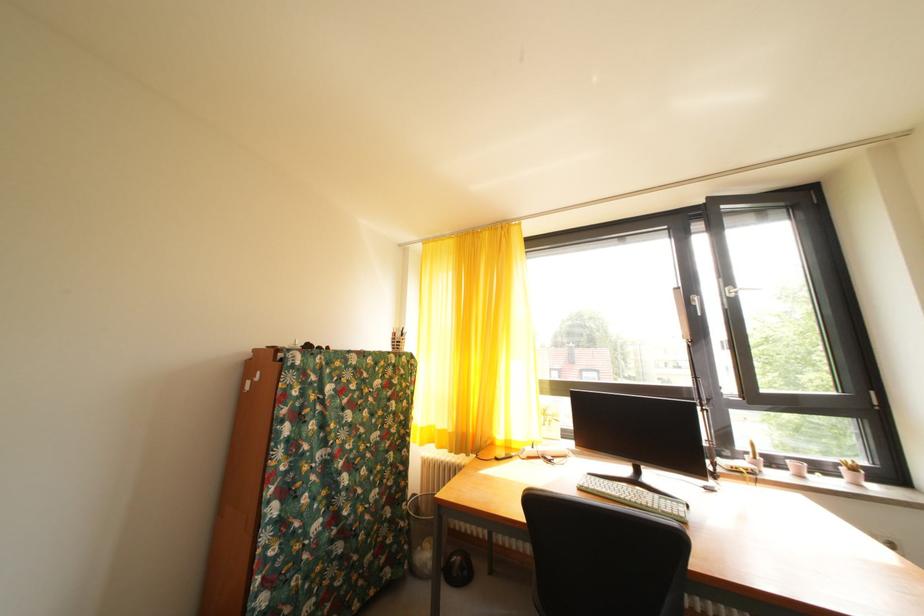
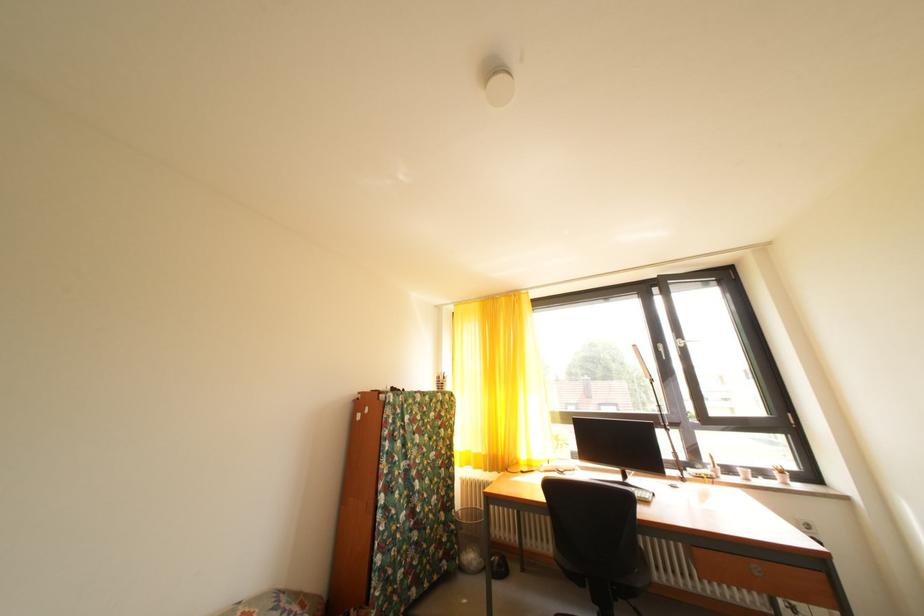
Question: Based on the continuous images, in which direction is the camera rotating? Reply with the corresponding letter.

Choices:
 (A) Left
 (B) Right
 (C) Up
 (D) Down

Answer: (C)